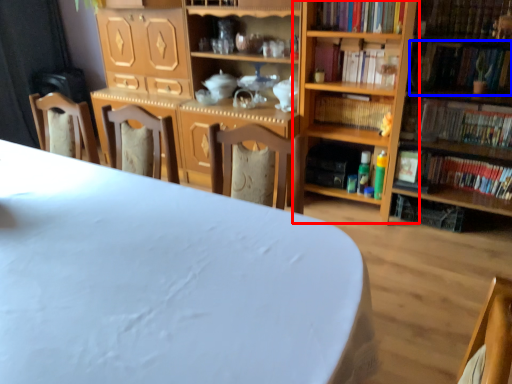
Question: Which point is further to the camera, shelf (highlighted by a red box) or book (highlighted by a blue box)?

Choices:
 (A) shelf
 (B) book

Answer: (A)